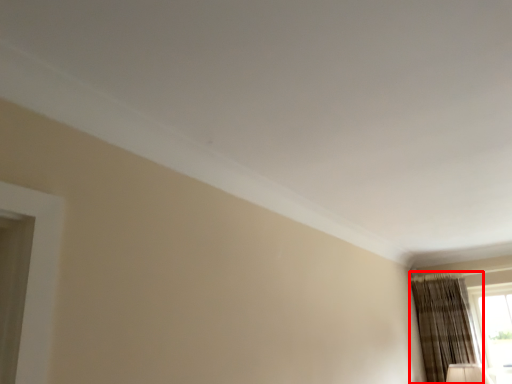
Question: Considering the relative positions of curtain (annotated by the red box) and window in the image provided, where is curtain (annotated by the red box) located with respect to the staircase?

Choices:
 (A) left
 (B) right

Answer: (A)